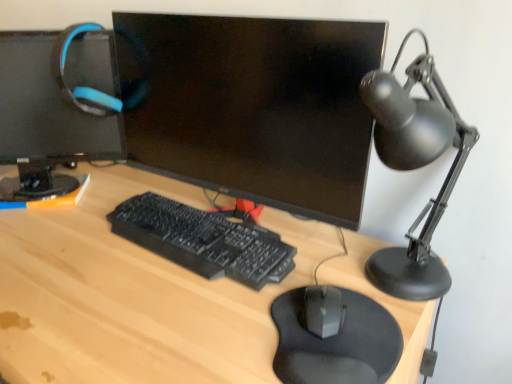
Locate an element on the screen. The height and width of the screenshot is (384, 512). free space above black plastic keyboard at center (from a real-world perspective) is located at coordinates (195, 225).